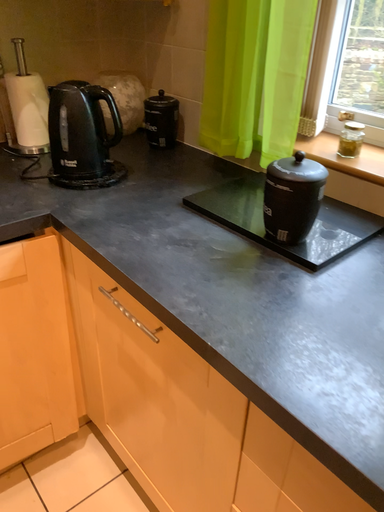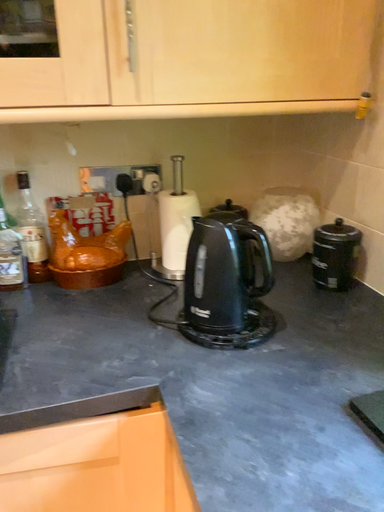
Question: Which way did the camera rotate in the video?

Choices:
 (A) rotated left
 (B) rotated right

Answer: (A)